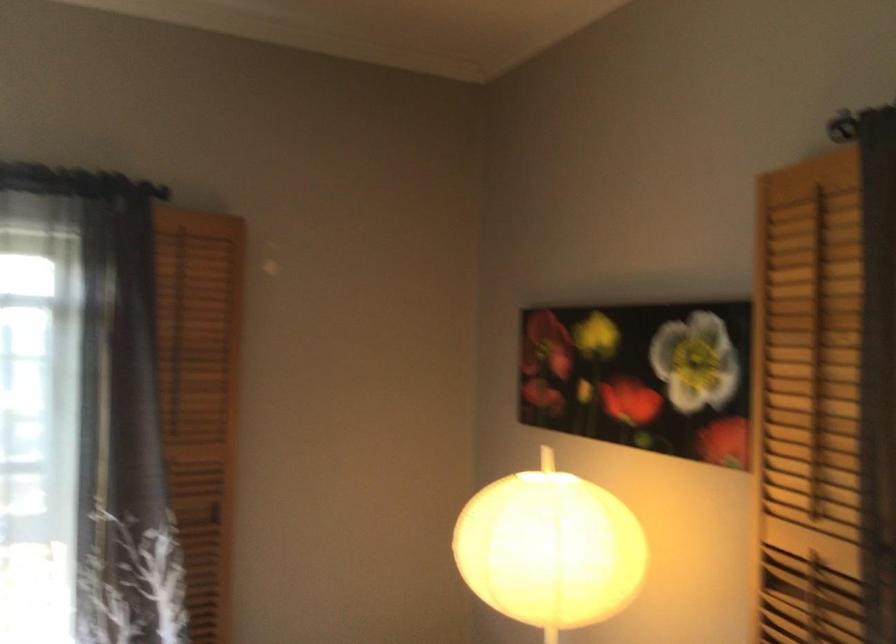
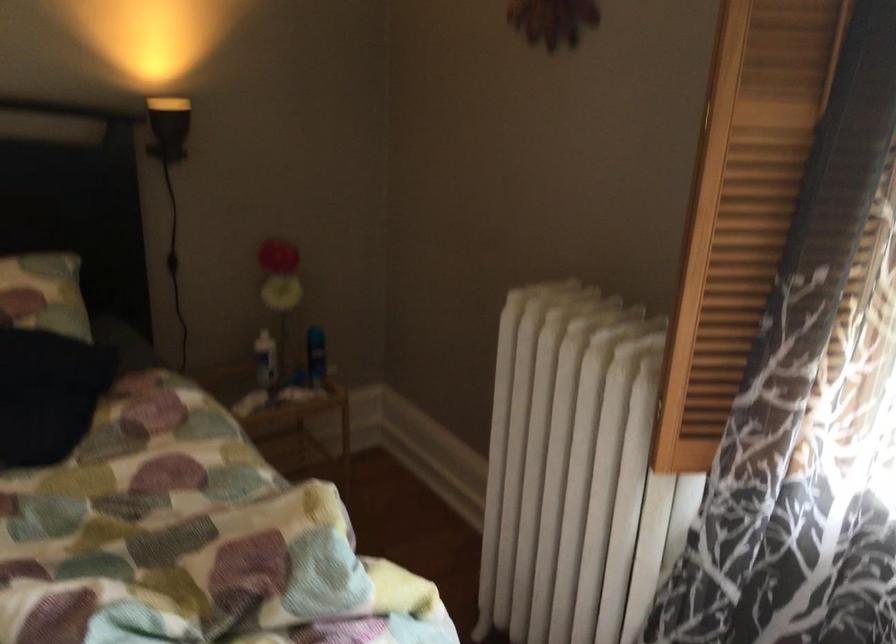
The first image is from the beginning of the video and the second image is from the end. How did the camera likely rotate when shooting the video?

The rotation direction of the camera is left-down.